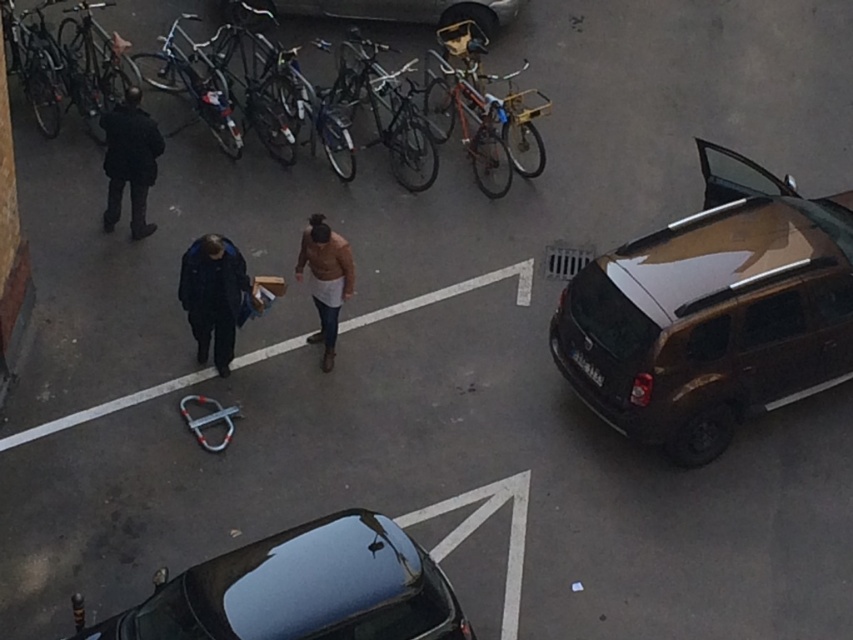
You are standing in the parking lot and see a person wearing a dark blue jacket at center and another wearing a dark wool coat at left. Which clothing item is closer to the ground?

The dark blue jacket at center is below dark wool coat at left, so it is closer to the ground.

You are standing at the bottom left corner of the parking lot and want to pick up the dark blue jacket at center. Which direction should you move to reach it?

The dark blue jacket at center is located at point 0.464 on the x axis and 0.252 on the y axis. Since you are at the bottom left corner, which is the origin point, moving towards the right and slightly upwards would bring you closer to the jacket.

You are standing at the bottom left corner of the parking lot and want to reach the dark blue jacket at center. Which direction should you move in to get there?

The dark blue jacket at center is located at point (213, 296), so you should move towards the center of the parking lot from the bottom left corner.